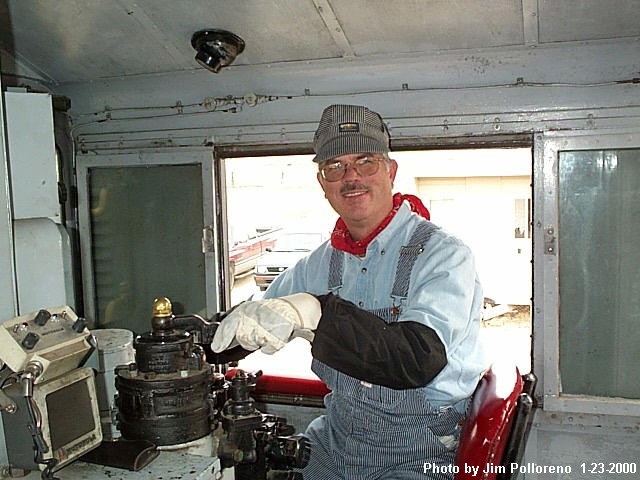
This screenshot has width=640, height=480. I want to click on chair, so click(x=491, y=411).